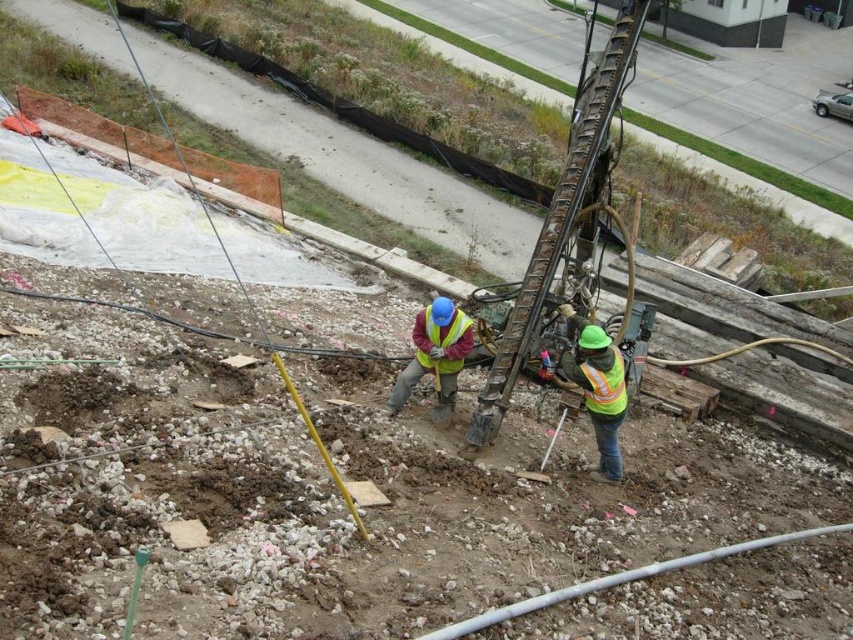
You are a safety inspector observing the construction site from above. You notice the metallic drill rig at center and the reflective yellow vest at center. Which object is located to the right of the other?

The metallic drill rig at center is positioned on the right side of reflective yellow vest at center.

You are a safety inspector at the construction site. You notice two points marked on the ground at coordinates point (490, 387) and point (469, 321). According to the image, which point is closer to the drilling rig?

Point (469, 321) is closer to the drilling rig because it is in front of point (490, 387), which is behind it.